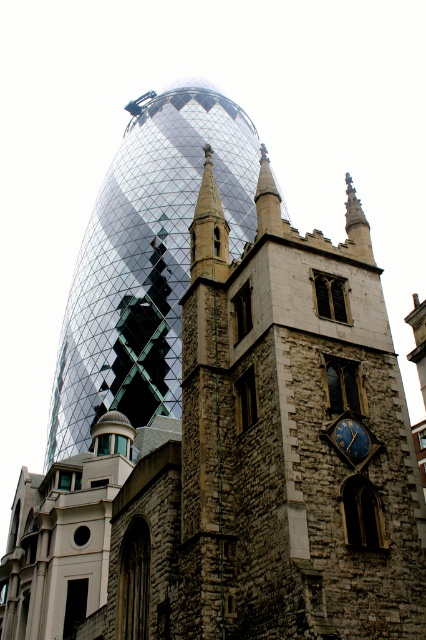
You are standing at the center of the image. Which direction should you move to reach the reflective glass tower at center?

You are already at the center of the image, so you don not need to move to reach the reflective glass tower at center.

You are an architect analyzing the spatial layout of the image. Given that the reflective glass tower at center is located at point (146, 259), what is the coordinate of the historic stone tower on the right side?

The coordinate of the historic stone tower on the right side is not provided in the Objects Description.